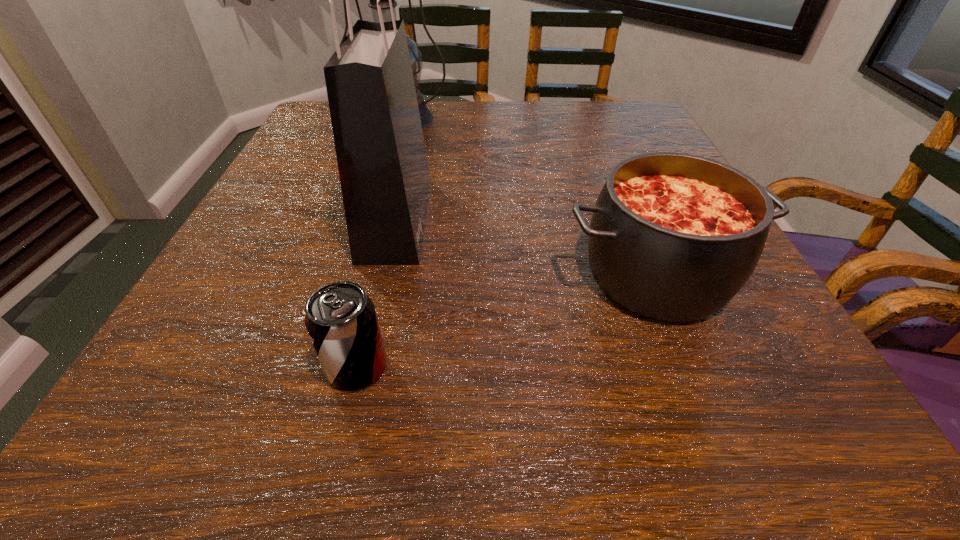
This screenshot has width=960, height=540. What are the coordinates of `vacant region that satisfies the following two spatial constraints: 1. on the front side of the oil lamp; 2. on the right side of the soda can` in the screenshot? It's located at (322, 367).

Locate an element on the screen. The width and height of the screenshot is (960, 540). free spot that satisfies the following two spatial constraints: 1. on the front with handles of the shopping bag; 2. on the left side of the rightmost object is located at coordinates (384, 275).

This screenshot has height=540, width=960. Identify the location of vacant region that satisfies the following two spatial constraints: 1. on the front with handles of the casserole; 2. on the left side of the shopping bag. (384, 275).